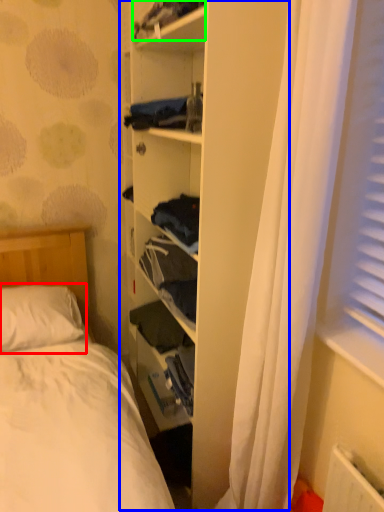
Question: Which object is the farthest from pillow (highlighted by a red box)? Choose among these: bookshelf (highlighted by a blue box) or clothing (highlighted by a green box).

Choices:
 (A) bookshelf
 (B) clothing

Answer: (B)